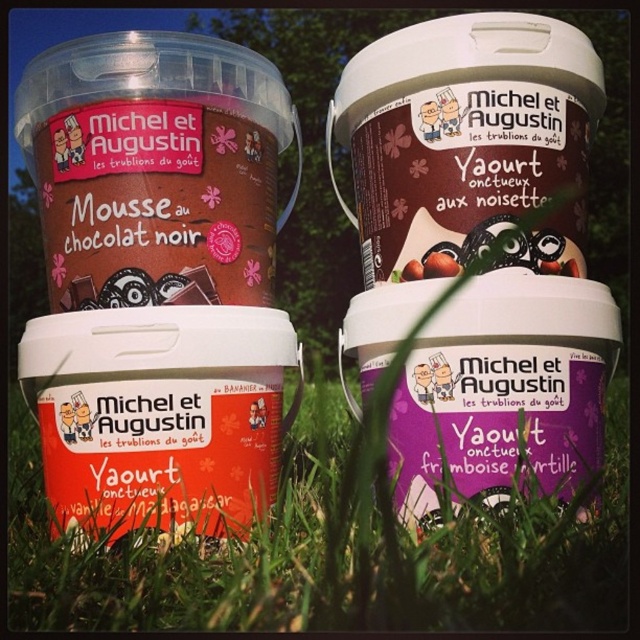
You are standing in a garden and see the purple matte yogurt at center. Where exactly is it positioned in relation to the other tubs?

The purple matte yogurt at center is located at point coordinates of 0.389 along the x axis and 0.745 along the y axis.

In the scene shown: Which object is located at the point with coordinates (476,248)?

The point with coordinates (476,248) is on the purple matte yogurt at center.

You are a customer looking at the image of the four tubs of Michel et Augustin products. You want to place a new small decorative item between the green grass at lower center and the matte chocolate spread at center. Based on their positions, where should you place it?

The green grass at lower center is in front of the matte chocolate spread at center, so you should place the new item between them, closer to the green grass at lower center to maintain the spatial arrangement.